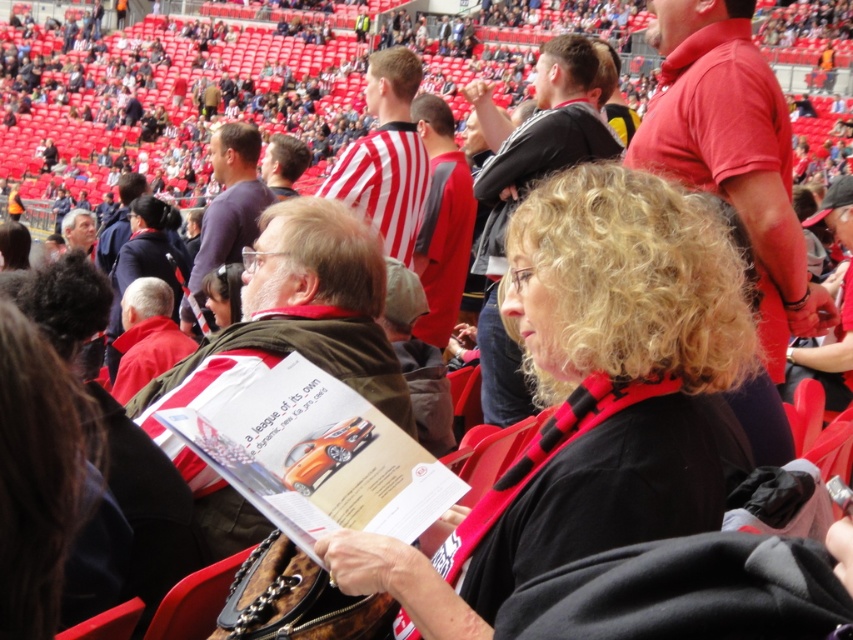
In the scene shown: You are a spectator at the stadium and want to check the brochure you are holding. Which item is positioned lower between the black matte scarf at center and the matte brown jacket at center?

The black matte scarf at center is positioned below the matte brown jacket at center, so it is lower.

You are trying to decide whether the black matte scarf at center can be placed on top of the matte brown jacket at center without hanging off the edges. According to the description, can it fit?

The black matte scarf at center has a larger width than the matte brown jacket at center, so placing it on top would cause it to hang off the edges since it is wider than the jacket.

You are attending a sports event and notice two items in the image. The first is a black matte scarf at center, and the second is a purple matte shirt at upper center. Which of these items is larger in size?

The purple matte shirt at upper center is larger than the black matte scarf at center.